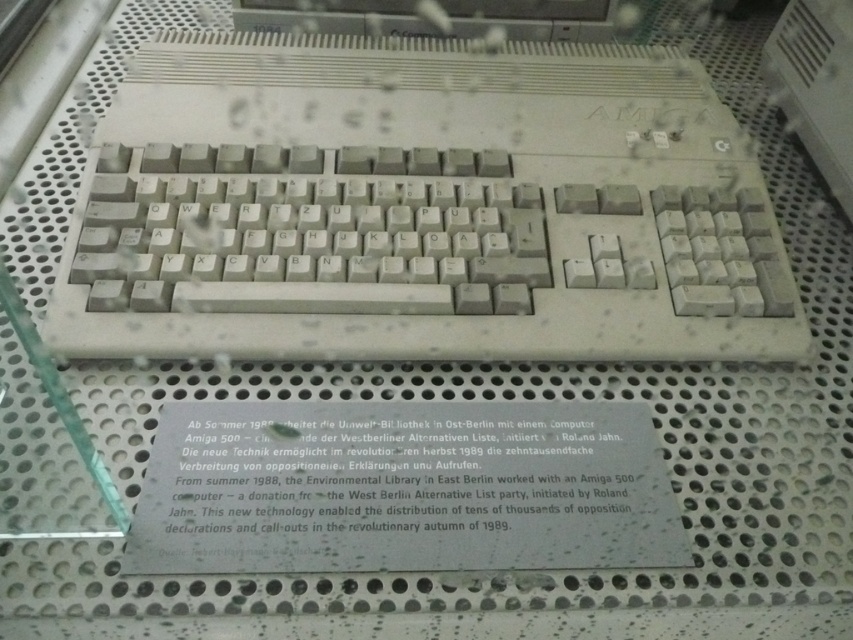
The height and width of the screenshot is (640, 853). Describe the element at coordinates (532, 19) in the screenshot. I see `white plastic monitor at upper center` at that location.

Who is more forward, (x=556, y=33) or (x=773, y=52)?

Point (x=556, y=33) is more forward.

At what (x,y) coordinates should I click in order to perform the action: click on white plastic monitor at upper center. Please return your answer as a coordinate pair (x, y). The height and width of the screenshot is (640, 853). Looking at the image, I should click on (532, 19).

Does beige plastic keyboard at center have a lesser width compared to white plastic keyboard at upper right?

No.

Is beige plastic keyboard at center smaller than white plastic keyboard at upper right?

Actually, beige plastic keyboard at center might be larger than white plastic keyboard at upper right.

This screenshot has width=853, height=640. Describe the element at coordinates (421, 208) in the screenshot. I see `beige plastic keyboard at center` at that location.

Locate an element on the screen. beige plastic keyboard at center is located at coordinates (421, 208).

Which is in front, point (177, 182) or point (350, 19)?

Point (177, 182) is in front.

How distant is beige plastic keyboard at center from white plastic monitor at upper center?

The distance of beige plastic keyboard at center from white plastic monitor at upper center is 8.46 inches.

Is point (189, 90) positioned in front of point (535, 3)?

That is True.

The height and width of the screenshot is (640, 853). What are the coordinates of `beige plastic keyboard at center` in the screenshot? It's located at point(421,208).